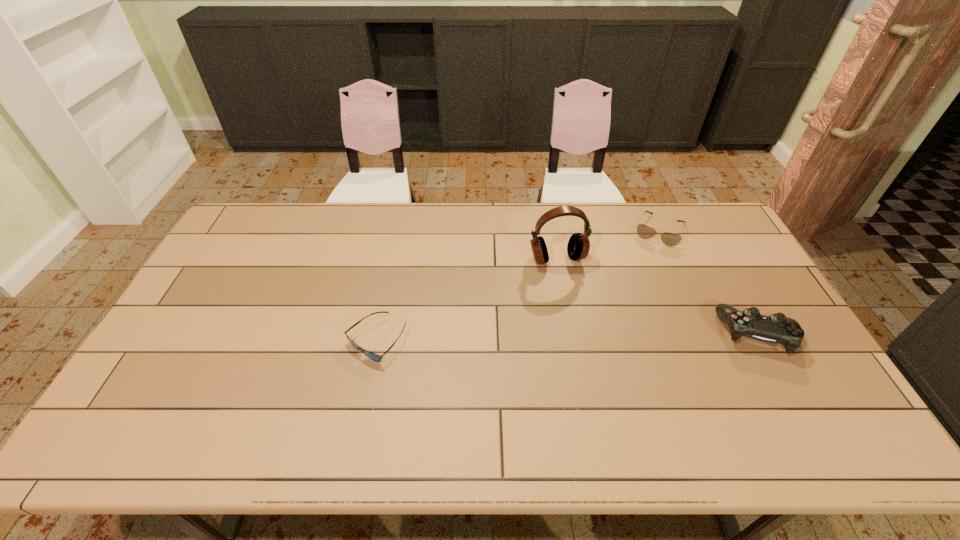
Identify the location of vacant area situated 0.160m on the ear pads of the tallest object. (577, 307).

Image resolution: width=960 pixels, height=540 pixels. I want to click on free location located 0.240m on the ear pads of the tallest object, so click(x=586, y=328).

The width and height of the screenshot is (960, 540). Find the location of `blank space located on the front-facing side of the farthest object`. blank space located on the front-facing side of the farthest object is located at coordinates (640, 276).

The image size is (960, 540). Find the location of `vacant region located 0.150m on the front-facing side of the farthest object`. vacant region located 0.150m on the front-facing side of the farthest object is located at coordinates (642, 273).

Locate an element on the screen. Image resolution: width=960 pixels, height=540 pixels. free location located on the front-facing side of the farthest object is located at coordinates (637, 285).

Where is `object located at the far edge`? The height and width of the screenshot is (540, 960). object located at the far edge is located at coordinates (670, 239).

Locate an element on the screen. control that is positioned at the right edge is located at coordinates (777, 328).

Find the location of a particular element. This screenshot has width=960, height=540. sunglasses located at the right edge is located at coordinates (670, 239).

You are a GUI agent. You are given a task and a screenshot of the screen. Output one action in this format:
    pyautogui.click(x=<x>, y=<y>)
    Task: Click on the object that is at the far right corner
    
    Given the screenshot: What is the action you would take?
    pos(670,239)

This screenshot has height=540, width=960. I want to click on blank space at the far edge, so click(x=349, y=243).